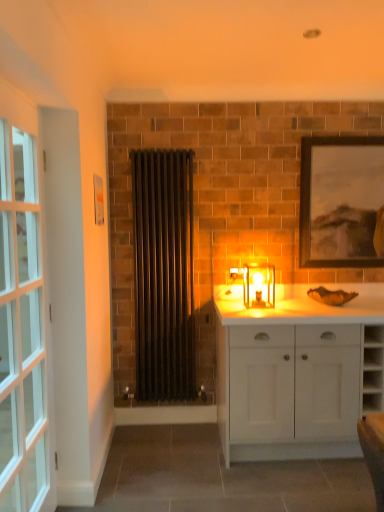
Describe the element at coordinates (163, 274) in the screenshot. I see `black metal radiator at center` at that location.

Where is `white matte cabinet at center`? This screenshot has width=384, height=512. white matte cabinet at center is located at coordinates (296, 373).

What do you see at coordinates (296, 373) in the screenshot? The image size is (384, 512). I see `white matte cabinet at center` at bounding box center [296, 373].

The width and height of the screenshot is (384, 512). What do you see at coordinates (259, 285) in the screenshot? I see `translucent glass candle at center` at bounding box center [259, 285].

In order to click on wooden framed artwork at upper right in this screenshot , I will do `click(342, 202)`.

The height and width of the screenshot is (512, 384). I want to click on clear glass door at left, so coord(21,328).

I want to click on black metal radiator at center, so point(163,274).

From a real-world perspective, is wooden framed artwork at upper right physically below clear glass door at left?

No, from a real-world perspective, wooden framed artwork at upper right is not under clear glass door at left.

How many degrees apart are the facing directions of wooden framed artwork at upper right and clear glass door at left?

They differ by 90.3 degrees in their facing directions.

Is point (321, 168) more distant than point (0, 406)?

Yes, point (321, 168) is behind point (0, 406).

From the image's perspective, who appears lower, wooden framed artwork at upper right or clear glass door at left?

clear glass door at left is shown below in the image.

Is clear glass door at left not near black metal radiator at center?

Absolutely, clear glass door at left is distant from black metal radiator at center.

In the scene shown: Which is behind, clear glass door at left or black metal radiator at center?

Positioned behind is black metal radiator at center.

Considering the points (13, 426) and (153, 324), which point is in front, point (13, 426) or point (153, 324)?

Point (13, 426)

Is clear glass door at left closer to camera compared to wooden framed artwork at upper right?

Yes, it is in front of wooden framed artwork at upper right.

Consider the image. Does clear glass door at left contain wooden framed artwork at upper right?

Definitely not — wooden framed artwork at upper right is not inside clear glass door at left.

How different are the orientations of clear glass door at left and wooden framed artwork at upper right in degrees?

clear glass door at left and wooden framed artwork at upper right are facing 90.3 degrees away from each other.

Can you see clear glass door at left touching wooden framed artwork at upper right?

clear glass door at left and wooden framed artwork at upper right are clearly separated.

The height and width of the screenshot is (512, 384). In order to click on cabinetry below the wooden framed artwork at upper right (from a real-world perspective) in this screenshot , I will do `click(296, 373)`.

From a real-world perspective, which object rests below the other?

From a 3D spatial view, white matte cabinet at center is below.

Between wooden framed artwork at upper right and white matte cabinet at center, which one has more height?

Standing taller between the two is wooden framed artwork at upper right.

Considering the positions of objects wooden framed artwork at upper right and white matte cabinet at center in the image provided, who is in front, wooden framed artwork at upper right or white matte cabinet at center?

white matte cabinet at center is more forward.

Is translucent glass candle at center taller than white matte cabinet at center?

In fact, translucent glass candle at center may be shorter than white matte cabinet at center.

From a real-world perspective, is translucent glass candle at center on top of white matte cabinet at center?

Yes, from a real-world perspective, translucent glass candle at center is above white matte cabinet at center.

Based on the photo, is translucent glass candle at center next to white matte cabinet at center and touching it?

No, translucent glass candle at center is not making contact with white matte cabinet at center.

Is black metal radiator at center placed right next to translucent glass candle at center?

No, black metal radiator at center is not with translucent glass candle at center.

In the scene shown: From the image's perspective, is black metal radiator at center over translucent glass candle at center?

Indeed, from the image's perspective, black metal radiator at center is shown above translucent glass candle at center.

From a real-world perspective, is black metal radiator at center on top of translucent glass candle at center?

Correct, in the physical world, black metal radiator at center is higher than translucent glass candle at center.

Which is behind, point (175, 176) or point (268, 265)?

Positioned behind is point (268, 265).

From the image's perspective, does translucent glass candle at center appear lower than wooden framed artwork at upper right?

Yes, from the image's perspective, translucent glass candle at center is below wooden framed artwork at upper right.

Is translucent glass candle at center facing towards wooden framed artwork at upper right?

No, translucent glass candle at center is not oriented towards wooden framed artwork at upper right.

Where is `candle holder in front of the wooden framed artwork at upper right`? candle holder in front of the wooden framed artwork at upper right is located at coordinates (259, 285).

Between translucent glass candle at center and wooden framed artwork at upper right, which one has more height?

Standing taller between the two is wooden framed artwork at upper right.

Where is `picture frame on the right of clear glass door at left`? The width and height of the screenshot is (384, 512). picture frame on the right of clear glass door at left is located at coordinates (342, 202).

Locate an element on the screen. This screenshot has width=384, height=512. curtain lying above the clear glass door at left (from the image's perspective) is located at coordinates point(163,274).

Looking at the image, which one is located further to wooden framed artwork at upper right, clear glass door at left or translucent glass candle at center?

clear glass door at left.

From the image, which object appears to be farther from white matte cabinet at center, clear glass door at left or black metal radiator at center?

Based on the image, clear glass door at left appears to be further to white matte cabinet at center.

Which object lies nearer to the anchor point white matte cabinet at center, clear glass door at left or translucent glass candle at center?

translucent glass candle at center.

Looking at the image, which one is located further to translucent glass candle at center, wooden framed artwork at upper right or white matte cabinet at center?

wooden framed artwork at upper right is further to translucent glass candle at center.

When comparing their distances from wooden framed artwork at upper right, does clear glass door at left or white matte cabinet at center seem further?

clear glass door at left lies further to wooden framed artwork at upper right than the other object.

When comparing their distances from translucent glass candle at center, does wooden framed artwork at upper right or clear glass door at left seem closer?

wooden framed artwork at upper right is closer to translucent glass candle at center.

Estimate the real-world distances between objects in this image. Which object is further from white matte cabinet at center, black metal radiator at center or clear glass door at left?

clear glass door at left is positioned further to the anchor white matte cabinet at center.

From the image, which object appears to be farther from clear glass door at left, black metal radiator at center or white matte cabinet at center?

white matte cabinet at center.

The height and width of the screenshot is (512, 384). What are the coordinates of `candle holder between clear glass door at left and black metal radiator at center from front to back` in the screenshot? It's located at [259, 285].

Where is `candle holder between black metal radiator at center and white matte cabinet at center in the horizontal direction`? Image resolution: width=384 pixels, height=512 pixels. candle holder between black metal radiator at center and white matte cabinet at center in the horizontal direction is located at coordinates (259, 285).

Locate an element on the screen. The width and height of the screenshot is (384, 512). cabinetry between clear glass door at left and black metal radiator at center from front to back is located at coordinates (296, 373).

Locate an element on the screen. The width and height of the screenshot is (384, 512). candle holder located between clear glass door at left and white matte cabinet at center in the left-right direction is located at coordinates (259, 285).